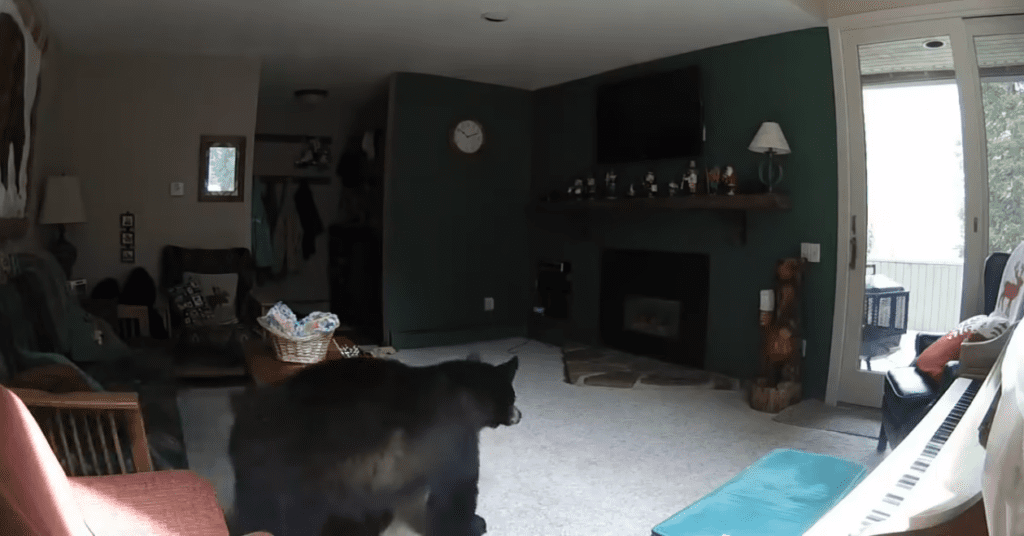
In order to click on bear in a living room in this screenshot , I will do click(389, 419).